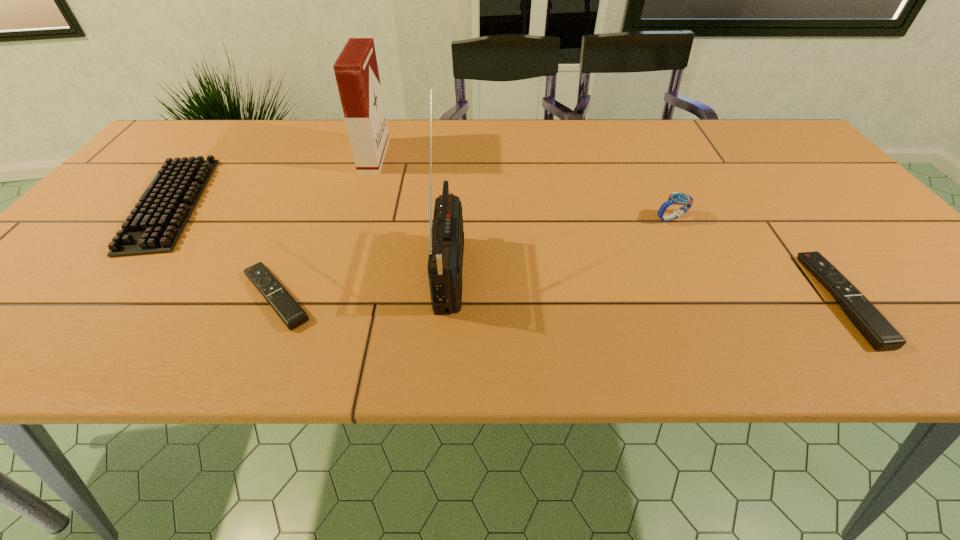
In the image, there is a desktop. In order to click on vacant area at the far edge in this screenshot , I will do (x=225, y=143).

The image size is (960, 540). What are the coordinates of `vacant point at the near edge` in the screenshot? It's located at pos(98,304).

At what (x,y) coordinates should I click in order to perform the action: click on free space at the right edge. Please return your answer as a coordinate pair (x, y). Looking at the image, I should click on (911, 282).

Identify the location of vacant region at the near right corner of the desktop. (868, 298).

Locate an element on the screen. Image resolution: width=960 pixels, height=540 pixels. free space that is in between the cigarette_case and the left remote control is located at coordinates (325, 226).

Find the location of a particular element. The height and width of the screenshot is (540, 960). vacant space in between the taller remote control and the third object from right to left is located at coordinates (646, 284).

You are a GUI agent. You are given a task and a screenshot of the screen. Output one action in this format:
    pyautogui.click(x=<x>, y=<y>)
    Task: Click on the vacant area between the fifth shortest object and the fourth shortest object
    The width and height of the screenshot is (960, 540).
    Given the screenshot: What is the action you would take?
    pyautogui.click(x=523, y=187)

Where is `empty space that is in between the fourth object from left to right and the rightmost object`? empty space that is in between the fourth object from left to right and the rightmost object is located at coordinates (646, 284).

What are the coordinates of `blank region between the fifth object from left to right and the rightmost object` in the screenshot? It's located at (756, 259).

The width and height of the screenshot is (960, 540). What are the coordinates of `free space between the cigarette_case and the leftmost object` in the screenshot? It's located at (273, 180).